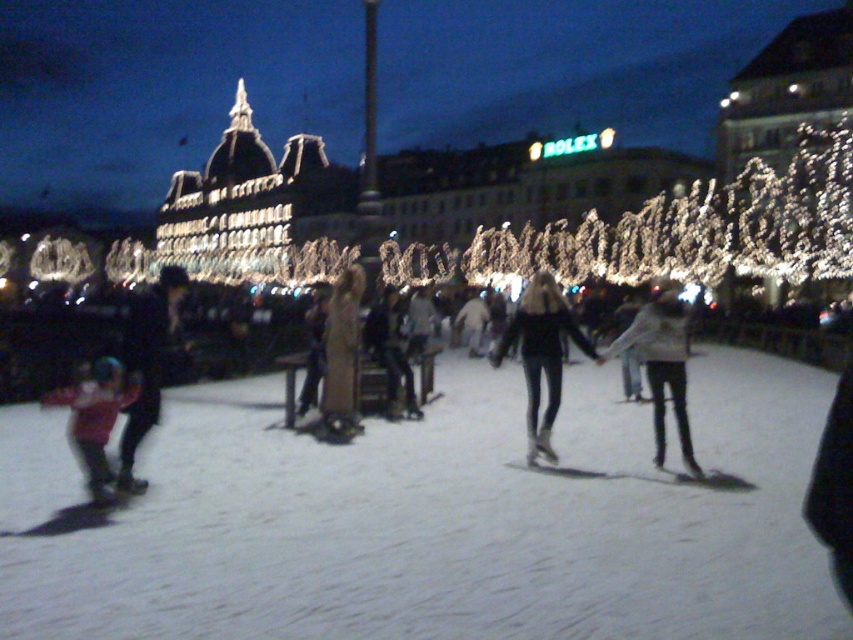
You are standing at the entrance of the ice skating rink and see the black matte jacket at center. If you want to move towards it, which direction should you skate in relation to the buildings with the Rolex sign?

The black matte jacket at center is located at point (541, 355). Since the Rolex sign is on a prominent building in the background, you should skate towards the center of the rink, which is where the jacket is positioned relative to the buildings.

You are an ice skater trying to find the perfect spot to start your spin. The ice rink has a white smooth ice at center. Where is the white smooth ice located in the image?

The white smooth ice at center is located at point (433, 518).

You are an ice skater wearing a black matte jacket at center and a matte pink jacket at lower left. You want to know which jacket is more likely to restrict your arm movement while skating. Based on the scene description, which jacket is thinner?

The black matte jacket at center is thinner than the matte pink jacket at lower left, so it is less likely to restrict arm movement compared to the matte pink jacket at lower left.